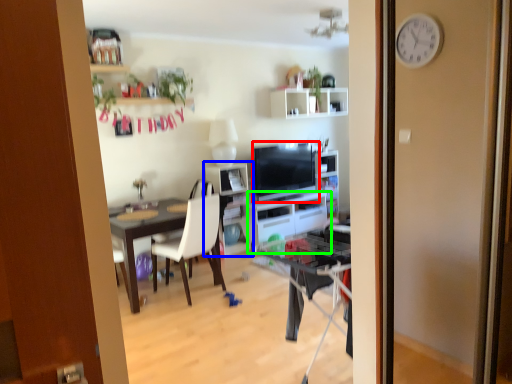
Question: Estimate the real-world distances between objects in this image. Which object is closer to television (highlighted by a red box), shelf (highlighted by a blue box) or cabinetry (highlighted by a green box)?

Choices:
 (A) shelf
 (B) cabinetry

Answer: (B)